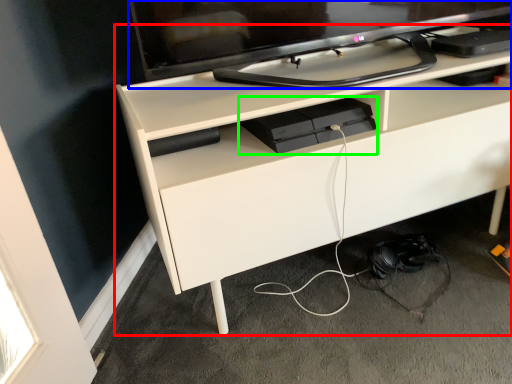
Question: Considering the real-world distances, which object is closest to desk (highlighted by a red box)? television (highlighted by a blue box) or equipment (highlighted by a green box).

Choices:
 (A) television
 (B) equipment

Answer: (B)